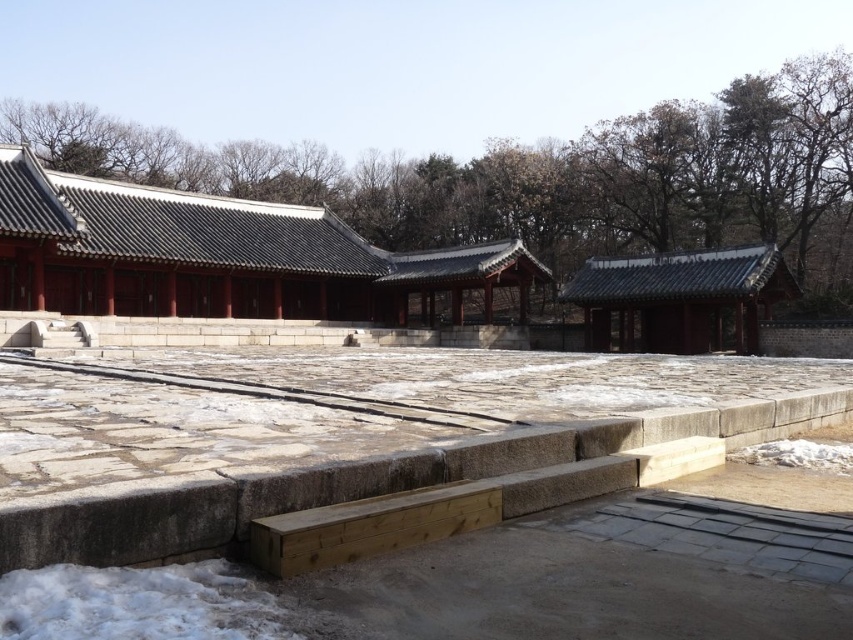
Is matte gray stone palace at center thinner than shiny dark gray roof at right?

Incorrect, matte gray stone palace at center's width is not less than shiny dark gray roof at right's.

Which is below, matte gray stone palace at center or shiny dark gray roof at right?

shiny dark gray roof at right is lower down.

Who is more distant from viewer, (x=10, y=200) or (x=567, y=300)?

The point (x=567, y=300) is behind.

Identify the location of matte gray stone palace at center. (219, 256).